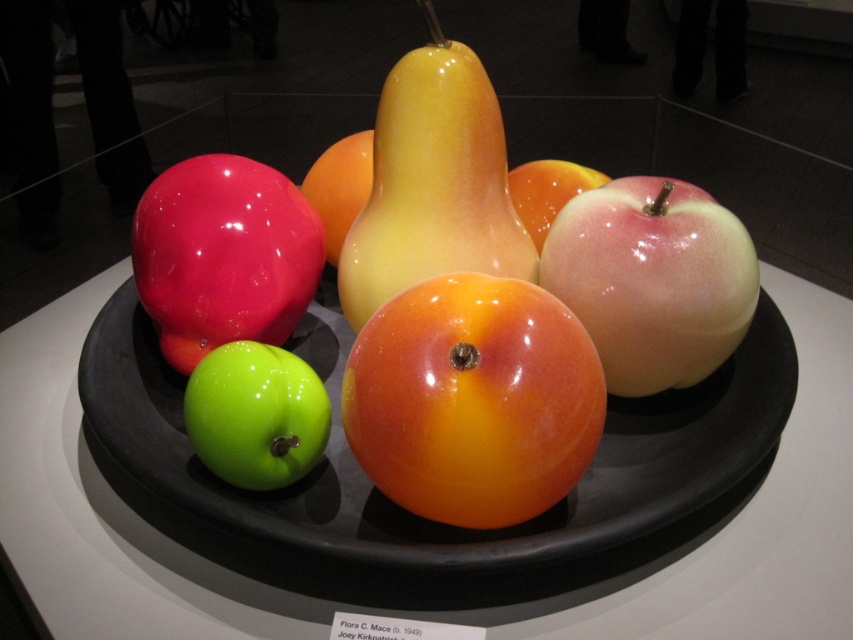
From the picture: You are arranging fruits on a glossy ceramic platter at center and a glossy orange apple at center. According to the scene description, which object is positioned to the right?

The glossy orange apple at center is positioned to the right of the glossy ceramic platter at center.

You are an artist planning to paint the fruits on the black circular tray. You want to ensure the size relationship between the glossy yellow pear at center and the glossy apple at center is accurate. Which fruit should you paint larger?

The glossy yellow pear at center should be painted larger than the glossy apple at center since it has a larger size compared to the glossy apple at center according to the description.